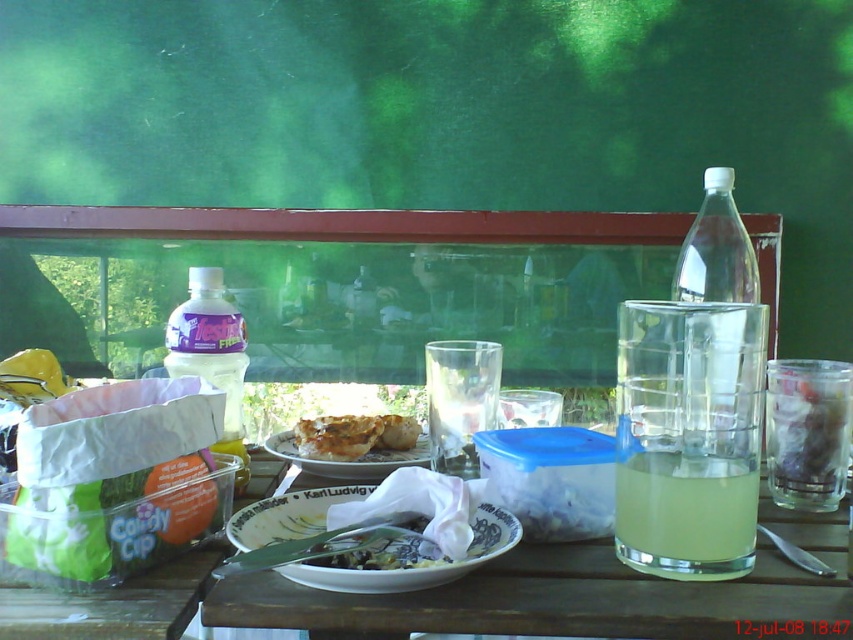
You need to pour the translucent yellow liquid at table center into the clear plastic bottle at right. Will the bottle be able to hold all of the liquid?

The translucent yellow liquid at table center is smaller than the clear plastic bottle at right, so yes, the bottle can hold all of the liquid.

You are at the picnic table and want to grab the clear glass filled with a yellowish liquid. The glass is located at point (x=741, y=481). You have a robotic arm with a reach of 20 inches. Can you reach the glass?

The distance between you and the clear glass filled with a yellowish liquid at point (x=741, y=481) is 21.55 inches. Since your robotic arm can only reach 20 inches, you cannot reach the glass.

You are setting up a picnic and need to pack items back into your bag. You have a limited space and must choose between the white paper plate at center and the translucent plastic bottle at left. Which item should you prioritize packing based on their sizes?

The white paper plate at center has a smaller size compared to the translucent plastic bottle at left, so you should prioritize packing the translucent plastic bottle at left first since it takes up more space.